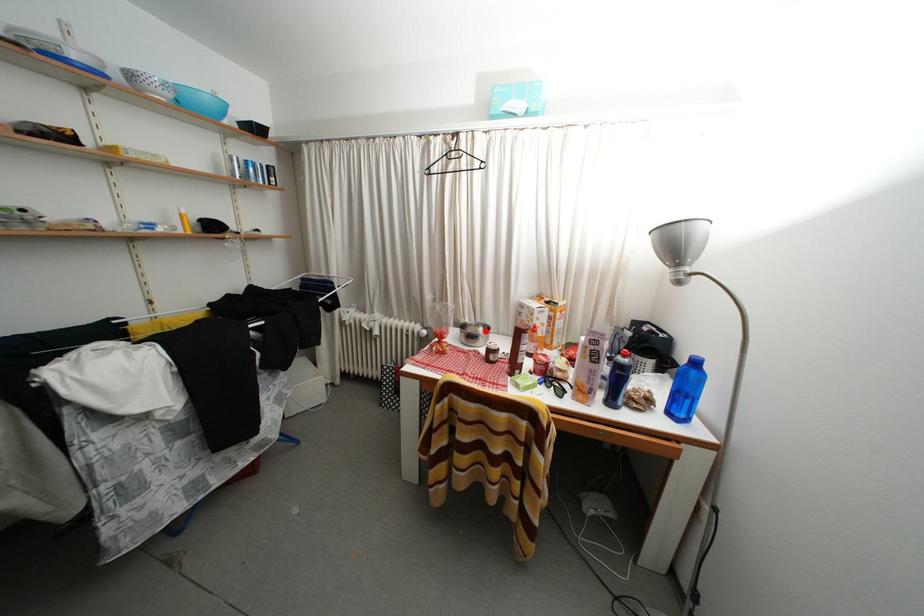
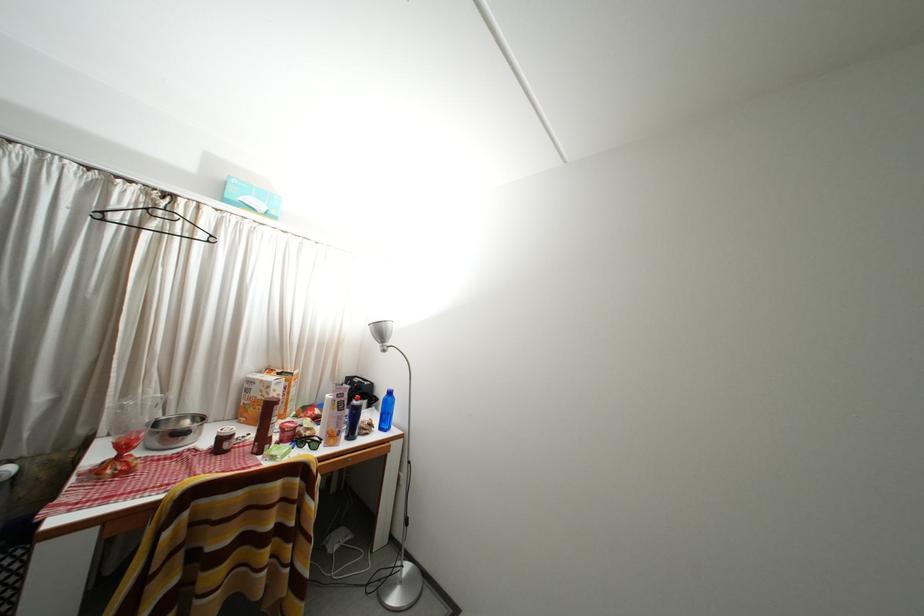
The point at the highlighted location is marked in the first image. Where is the corresponding point in the second image?

(188, 424)